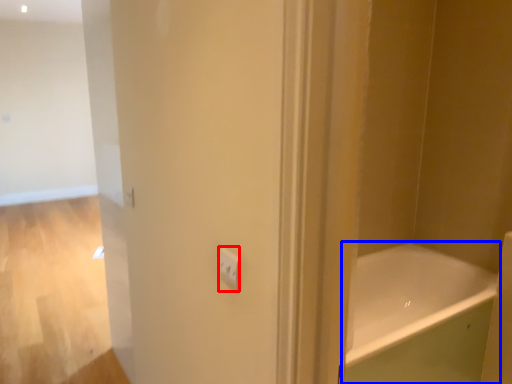
Question: Which point is further to the camera, light switch (highlighted by a red box) or bathtub (highlighted by a blue box)?

Choices:
 (A) light switch
 (B) bathtub

Answer: (B)